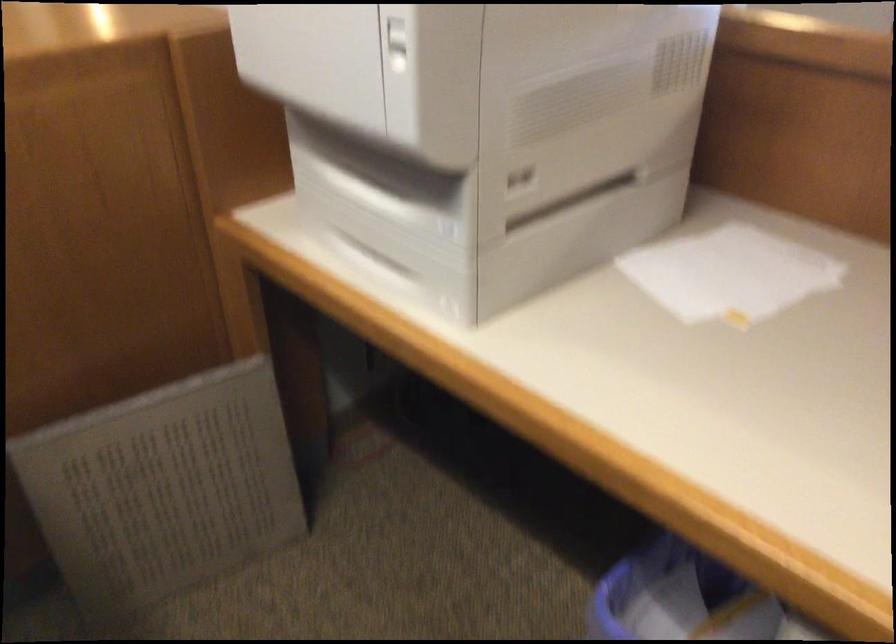
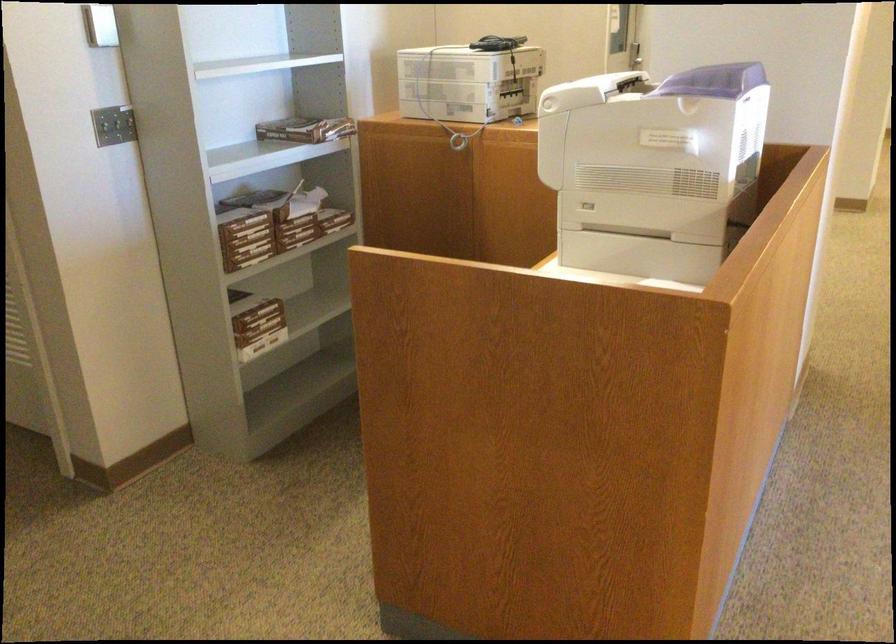
Question: I am providing you with two images of the same scene from different viewpoints. Please identify which objects are invisible in image2.

Choices:
 (A) blue trash can
 (B) furniture wheel
 (C) light switch
 (D) printer scanner lid

Answer: (A)